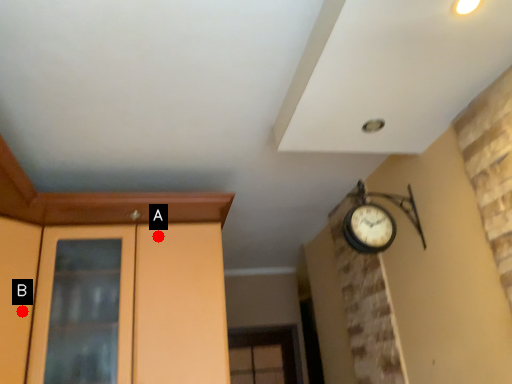
Question: Two points are circled on the image, labeled by A and B beside each circle. Which point appears closest to the camera in this image?

Choices:
 (A) A is closer
 (B) B is closer

Answer: (B)